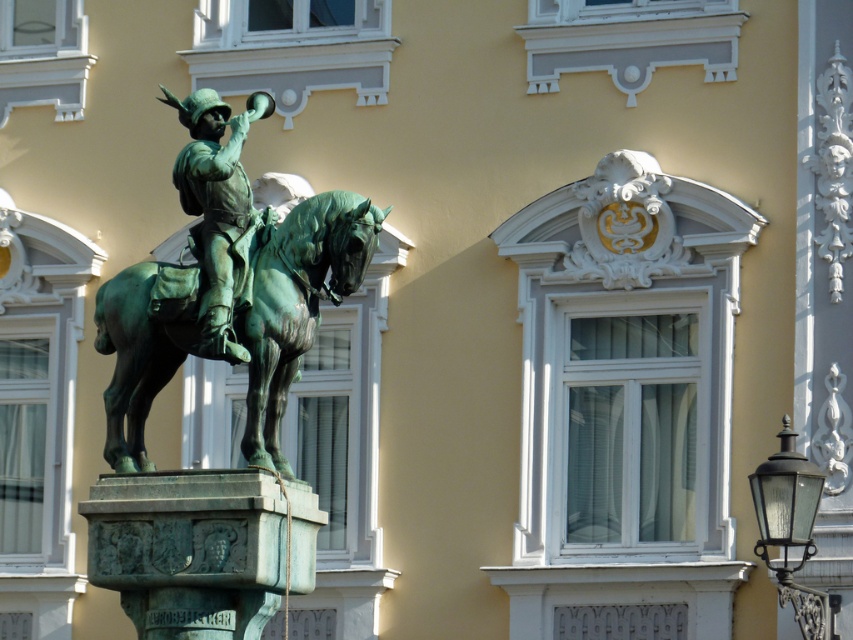
You are standing in front of the bronze statue of a mounted figure. The statue has a point marked at coordinates (297, 304). What object does this point indicate?

The point at coordinates (297, 304) marks the green patina horse at center.